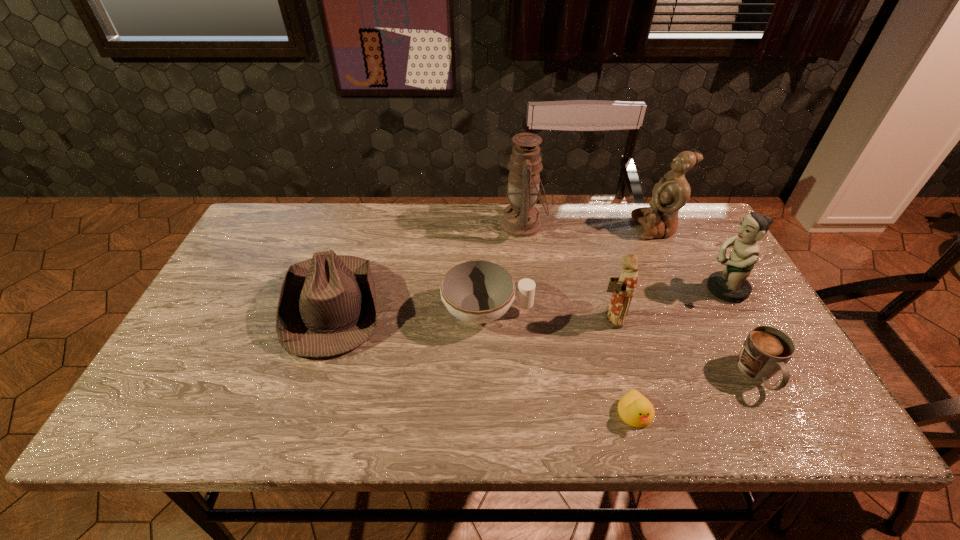
Where is `vacant space located on the side with the handle of the chinaware`? vacant space located on the side with the handle of the chinaware is located at coordinates (560, 312).

This screenshot has width=960, height=540. Identify the location of free space located on the side of the mug with the handle. (787, 430).

Where is `oil lamp at the far edge`? The height and width of the screenshot is (540, 960). oil lamp at the far edge is located at coordinates (520, 219).

The width and height of the screenshot is (960, 540). In order to click on figurine that is at the far edge in this screenshot , I will do `click(671, 193)`.

Image resolution: width=960 pixels, height=540 pixels. Find the location of `mug situated at the near edge`. mug situated at the near edge is located at coordinates (766, 350).

Find the location of `duckling that is at the near edge`. duckling that is at the near edge is located at coordinates (636, 410).

Where is `mug that is at the right edge`? mug that is at the right edge is located at coordinates (766, 350).

This screenshot has height=540, width=960. In order to click on object located at the far right corner in this screenshot , I will do 671,193.

This screenshot has width=960, height=540. Find the location of `object at the near right corner`. object at the near right corner is located at coordinates (766, 350).

The width and height of the screenshot is (960, 540). Find the location of `vacant space at the far edge of the desktop`. vacant space at the far edge of the desktop is located at coordinates (433, 211).